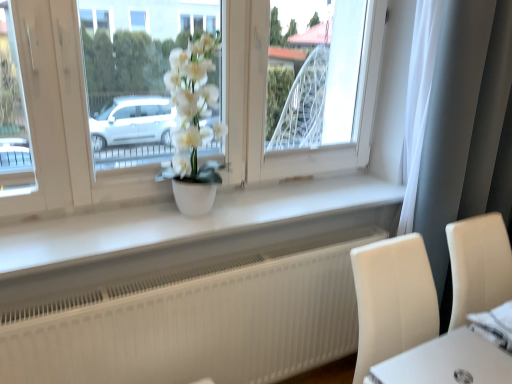
This screenshot has height=384, width=512. Identify the location of free space above white glossy round table at lower right (from a real-world perspective). (458, 365).